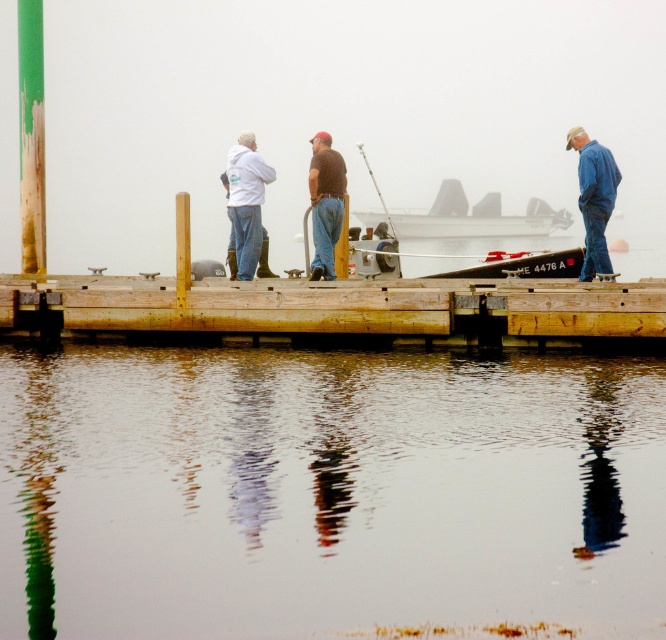
Looking at this image, who is shorter, weathered wood dock at center or white fleece jacket at center?

Standing shorter between the two is weathered wood dock at center.

Does point (186, 301) lie behind point (240, 276)?

No, it is in front of (240, 276).

The width and height of the screenshot is (666, 640). I want to click on weathered wood dock at center, so click(x=340, y=307).

Can you confirm if white fleece jacket at center is smaller than brown matte shirt at center?

No, white fleece jacket at center is not smaller than brown matte shirt at center.

Who is more forward, (248, 248) or (344, 182)?

Point (248, 248)

Is point (258, 244) more distant than point (324, 177)?

Yes, point (258, 244) is behind point (324, 177).

Identify the location of white fleece jacket at center. (246, 208).

Measure the distance between white matte boat at center and camera.

A distance of 126.18 feet exists between white matte boat at center and camera.

Does white matte boat at center have a lesser height compared to brown matte shirt at center?

In fact, white matte boat at center may be taller than brown matte shirt at center.

Which is in front, point (436, 225) or point (328, 202)?

Point (328, 202) is more forward.

At what (x,y) coordinates should I click in order to perform the action: click on white matte boat at center. Please return your answer as a coordinate pair (x, y). This screenshot has height=640, width=666. Looking at the image, I should click on (478, 216).